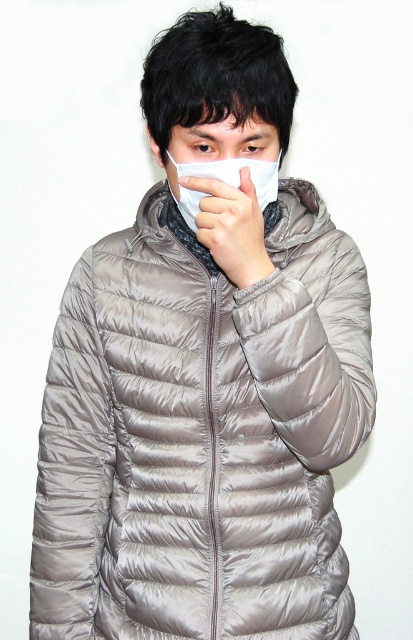
Question: Is the position of white matte mask at center less distant than that of white matte handkerchief at center?

Choices:
 (A) yes
 (B) no

Answer: (A)

Question: Which of the following is the farthest from the observer?

Choices:
 (A) matte white nose at center
 (B) white matte mask at center
 (C) matte gray glove at center

Answer: (A)

Question: Does white matte mask at center have a greater width compared to white matte handkerchief at center?

Choices:
 (A) no
 (B) yes

Answer: (B)

Question: Which of the following is the closest to the observer?

Choices:
 (A) white matte mask at center
 (B) matte white nose at center
 (C) matte gray glove at center
 (D) white matte handkerchief at center

Answer: (A)

Question: Which object is the farthest from the white matte mask at center?

Choices:
 (A) matte gray glove at center
 (B) matte white nose at center
 (C) white matte handkerchief at center

Answer: (A)

Question: Is white matte mask at center thinner than matte white nose at center?

Choices:
 (A) yes
 (B) no

Answer: (B)